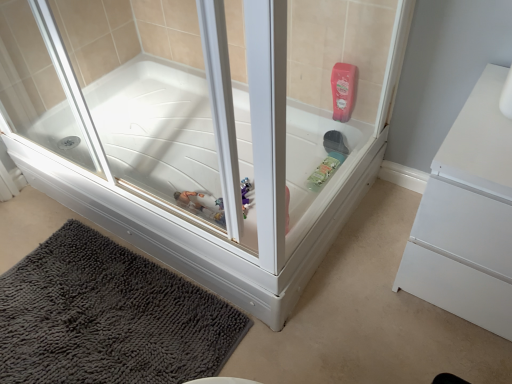
You are a GUI agent. You are given a task and a screenshot of the screen. Output one action in this format:
    pyautogui.click(x=<x>, y=<y>)
    Task: Click on the free spot below dark gray shaggy bath mat at lower left (from a real-world perspective)
    This screenshot has width=512, height=384.
    Given the screenshot: What is the action you would take?
    [x=99, y=318]